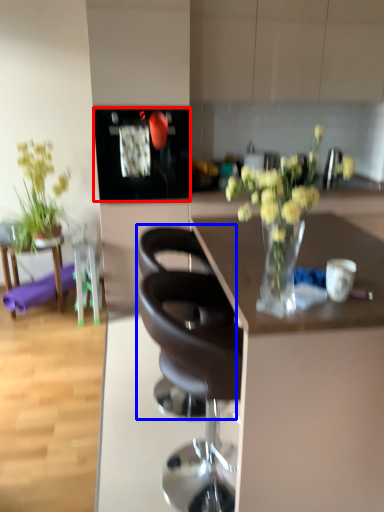
Question: Among these objects, which one is farthest to the camera, appliance (highlighted by a red box) or chair (highlighted by a blue box)?

Choices:
 (A) appliance
 (B) chair

Answer: (A)